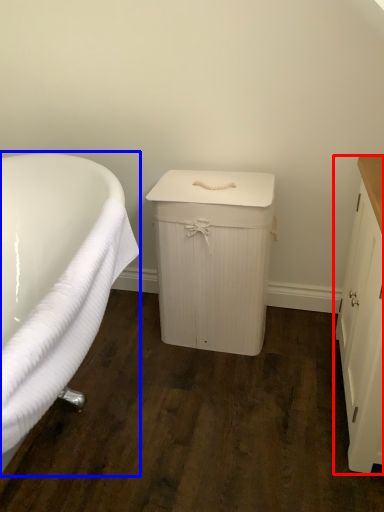
Question: Which point is closer to the camera, cabinetry (highlighted by a red box) or bathtub (highlighted by a blue box)?

Choices:
 (A) cabinetry
 (B) bathtub

Answer: (B)